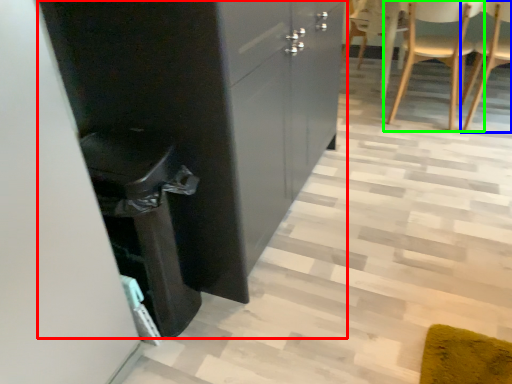
Question: Considering the real-world distances, which object is farthest from cabinetry (highlighted by a red box)? chair (highlighted by a blue box) or chair (highlighted by a green box)?

Choices:
 (A) chair
 (B) chair

Answer: (A)